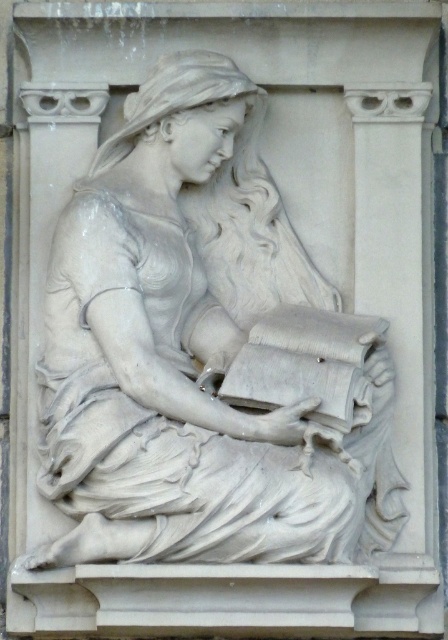
Which is behind, point (275, 372) or point (245, 344)?

The point (245, 344) is behind.

How distant is white marble statue at center from smooth white book at center?

A distance of 5.49 meters exists between white marble statue at center and smooth white book at center.

This screenshot has height=640, width=448. What do you see at coordinates (203, 353) in the screenshot?
I see `white marble statue at center` at bounding box center [203, 353].

The width and height of the screenshot is (448, 640). In order to click on white marble statue at center in this screenshot , I will do `click(203, 353)`.